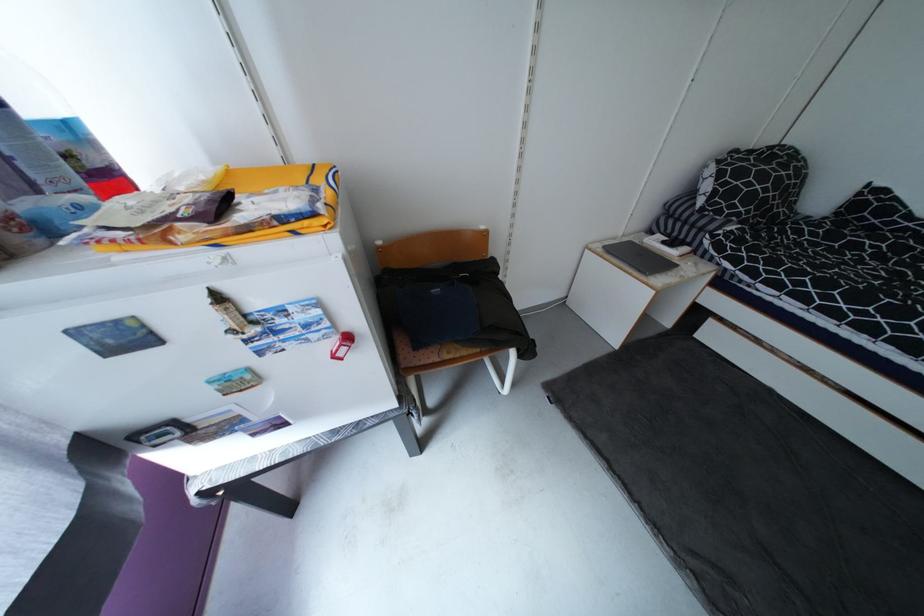
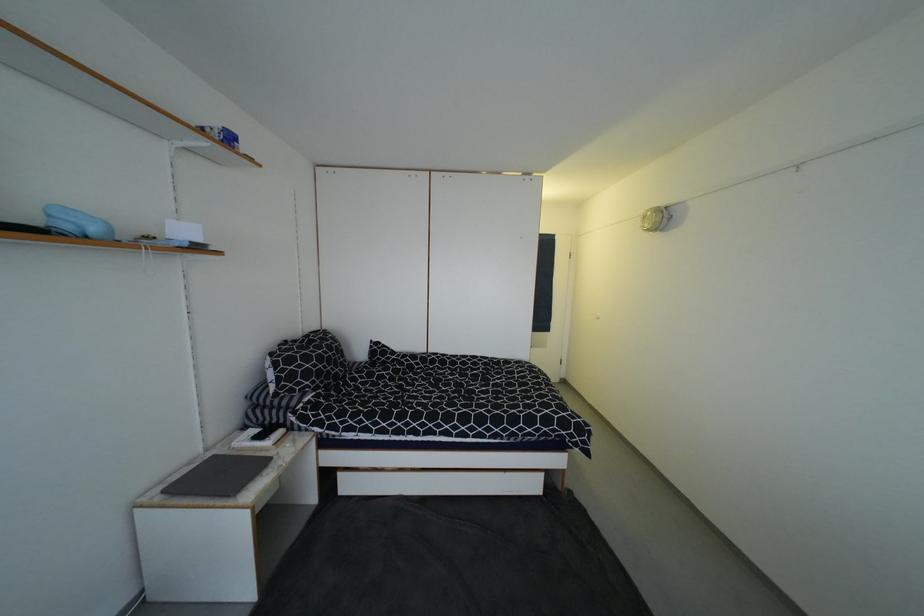
The point at (610, 249) is marked in the first image. Where is the corresponding point in the second image?

(169, 493)